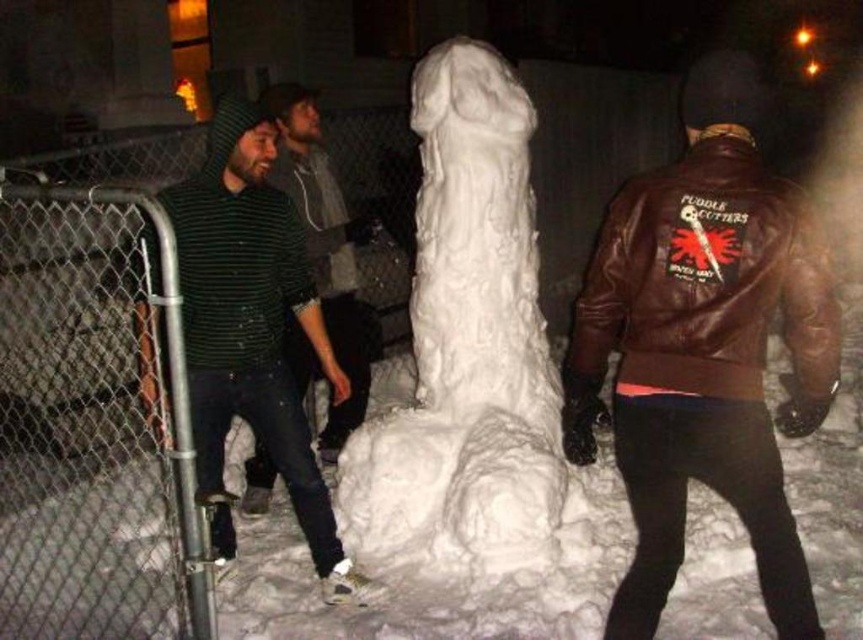
Question: Estimate the real-world distances between objects in this image. Which object is farther from the white fluffy snowman at center?

Choices:
 (A) green striped sweater at center
 (B) green striped sweater at left
 (C) brown leather jacket at center

Answer: (C)

Question: Among these objects, which one is nearest to the camera?

Choices:
 (A) brown leather jacket at center
 (B) green striped sweater at center

Answer: (A)

Question: Observing the image, what is the correct spatial positioning of brown leather jacket at center in reference to green striped sweater at left?

Choices:
 (A) right
 (B) left

Answer: (A)

Question: Among these points, which one is nearest to the camera?

Choices:
 (A) (734, 461)
 (B) (477, 100)
 (C) (209, 456)
 (D) (290, 97)

Answer: (A)

Question: Where is brown leather jacket at center located in relation to white fluffy snowman at center in the image?

Choices:
 (A) right
 (B) left

Answer: (A)

Question: Is brown leather jacket at center above green striped sweater at center?

Choices:
 (A) no
 (B) yes

Answer: (A)